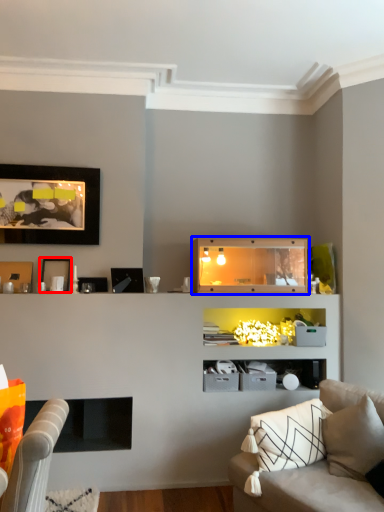
Question: Which object appears farthest to the camera in this image, picture frame (highlighted by a red box) or shelf (highlighted by a blue box)?

Choices:
 (A) picture frame
 (B) shelf

Answer: (A)